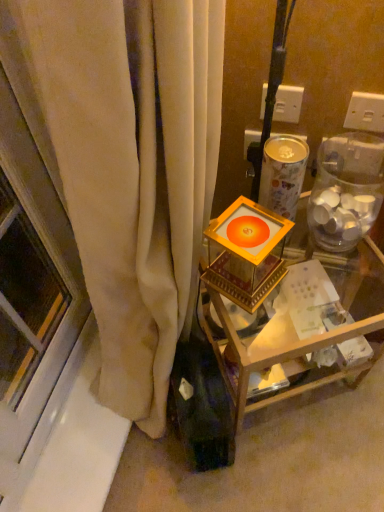
Question: From the image's perspective, is white plastic electric outlet at upper right, the 1th electric outlet in the left-to-right sequence, positioned above or below white plastic electric outlet at upper center, arranged as the second electric outlet when viewed from the left?

Choices:
 (A) above
 (B) below

Answer: (A)

Question: In the image, is white plastic electric outlet at upper right, the 1th electric outlet in the left-to-right sequence, positioned in front of or behind white plastic electric outlet at upper center, placed as the 1th electric outlet when sorted from right to left?

Choices:
 (A) front
 (B) behind

Answer: (B)

Question: Which of these objects is positioned closest to the gold metallic frame at center?

Choices:
 (A) gold metallic candle holder at center
 (B) white plastic electric outlet at upper right, placed as the 2th electric outlet when sorted from right to left
 (C) white plastic electric outlet at upper center, arranged as the second electric outlet when viewed from the left
 (D) transparent plastic jar at right

Answer: (A)

Question: Which of these objects is positioned farthest from the gold metallic candle holder at center?

Choices:
 (A) gold metallic frame at center
 (B) white plastic electric outlet at upper center, placed as the 1th electric outlet when sorted from right to left
 (C) white plastic electric outlet at upper right, placed as the 2th electric outlet when sorted from right to left
 (D) transparent plastic jar at right

Answer: (B)